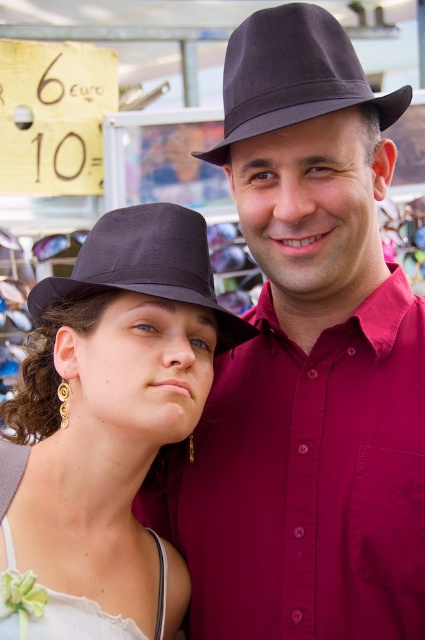
You are a customer at an outdoor market and see two matte black hats. One is the matte black hat at center and the other is the matte black fedora at upper left. Which hat is located lower in the image?

The matte black hat at center is positioned under the matte black fedora at upper left, so it is located lower in the image.

You are a photographer trying to capture both the matte black hat at center and the matte black fedora at upper left in a single shot. Which object should you focus on first if you want to ensure both are in focus, considering their heights?

The matte black hat at center has a greater height compared to the matte black fedora at upper left. To ensure both are in focus, focus on the matte black hat at center first, as it is taller and will require more depth of field to capture details.